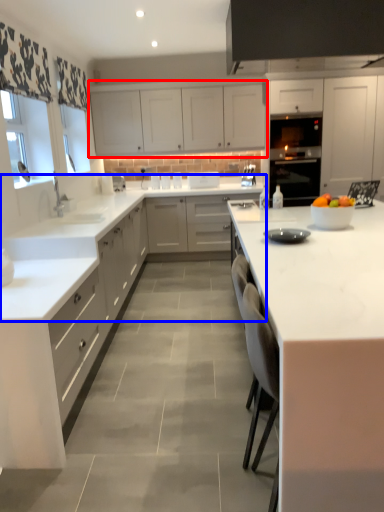
Question: Which object appears farthest to the camera in this image, cabinetry (highlighted by a red box) or countertop (highlighted by a blue box)?

Choices:
 (A) cabinetry
 (B) countertop

Answer: (A)